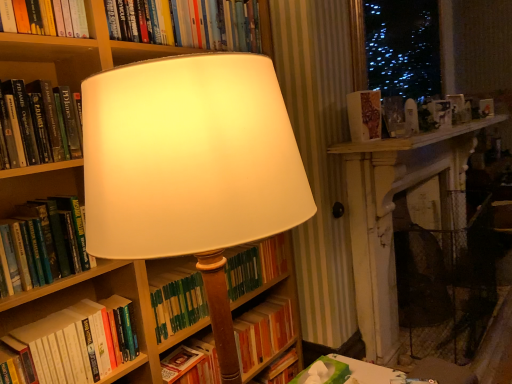
Question: Can you confirm if patterned paper book at upper right, marked as the 6th book in a bottom-to-top arrangement, is wider than green hardcover book at center, which appears as the seventh book when viewed from the top?

Choices:
 (A) yes
 (B) no

Answer: (B)

Question: Is patterned paper book at upper right, marked as the 6th book in a bottom-to-top arrangement, taller than green hardcover book at center, which is the 1th book in bottom-to-top order?

Choices:
 (A) yes
 (B) no

Answer: (B)

Question: Is patterned paper book at upper right, which is the 2th book from top to bottom, with green hardcover book at center, which appears as the seventh book when viewed from the top?

Choices:
 (A) no
 (B) yes

Answer: (A)

Question: Does patterned paper book at upper right, which is the 2th book from top to bottom, have a smaller size compared to green hardcover book at center, which is the 1th book in bottom-to-top order?

Choices:
 (A) no
 (B) yes

Answer: (B)

Question: Is patterned paper book at upper right, which is the 2th book from top to bottom, far away from green hardcover book at center, which is the 1th book in bottom-to-top order?

Choices:
 (A) yes
 (B) no

Answer: (B)

Question: Is point (211, 344) closer or farther from the camera than point (206, 31)?

Choices:
 (A) farther
 (B) closer

Answer: (A)

Question: In terms of width, does green hardcover book at center, which appears as the seventh book when viewed from the top, look wider or thinner when compared to hardcover book at upper center, which ranks as the seventh book in bottom-to-top order?

Choices:
 (A) wide
 (B) thin

Answer: (A)

Question: Considering the relative positions of green hardcover book at center, which appears as the seventh book when viewed from the top, and hardcover book at upper center, which ranks as the seventh book in bottom-to-top order, in the image provided, is green hardcover book at center, which appears as the seventh book when viewed from the top, to the left or to the right of hardcover book at upper center, which ranks as the seventh book in bottom-to-top order,?

Choices:
 (A) left
 (B) right

Answer: (B)

Question: Is green hardcover book at center, which is the 1th book in bottom-to-top order, bigger or smaller than hardcover book at upper center, which ranks as the seventh book in bottom-to-top order?

Choices:
 (A) big
 (B) small

Answer: (A)

Question: From a real-world perspective, is green matte book at center, which is counted as the 3th book, starting from the bottom, positioned above or below hardcover book at left, the fourth book in the top-to-bottom sequence?

Choices:
 (A) above
 (B) below

Answer: (B)

Question: In terms of width, does green matte book at center, which is counted as the 3th book, starting from the bottom, look wider or thinner when compared to hardcover book at left, which is the 4th book in bottom-to-top order?

Choices:
 (A) thin
 (B) wide

Answer: (B)

Question: Relative to hardcover book at left, which is the 4th book in bottom-to-top order, is green matte book at center, marked as the 5th book in a top-to-bottom arrangement, in front or behind?

Choices:
 (A) front
 (B) behind

Answer: (B)

Question: From their relative heights in the image, would you say green matte book at center, marked as the 5th book in a top-to-bottom arrangement, is taller or shorter than hardcover book at left, the fourth book in the top-to-bottom sequence?

Choices:
 (A) short
 (B) tall

Answer: (A)

Question: Do you think green hardcover book at center, which appears as the seventh book when viewed from the top, is within green matte book at center, marked as the 5th book in a top-to-bottom arrangement, or outside of it?

Choices:
 (A) inside
 (B) outside

Answer: (B)

Question: Visually, is green hardcover book at center, which is the 1th book in bottom-to-top order, positioned to the left or to the right of green matte book at center, marked as the 5th book in a top-to-bottom arrangement?

Choices:
 (A) right
 (B) left

Answer: (A)